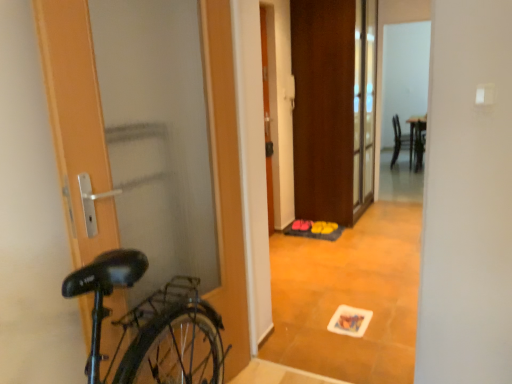
Question: Considering the positions of matte black chair at upper right and wooden floor mat at center in the image, is matte black chair at upper right bigger or smaller than wooden floor mat at center?

Choices:
 (A) big
 (B) small

Answer: (B)

Question: Is matte black chair at upper right in front of or behind wooden floor mat at center in the image?

Choices:
 (A) behind
 (B) front

Answer: (A)

Question: Which object is the closest to the wooden floor mat at center?

Choices:
 (A) brown matte door at center, placed as the 3th door when sorted from left to right
 (B) orange matte door at center, the 2th door positioned from the right
 (C) matte black chair at upper right
 (D) wooden door at left, arranged as the third door when viewed from the right
 (E) yellow rubber doormat at center

Answer: (E)

Question: Estimate the real-world distances between objects in this image. Which object is closer to the wooden floor mat at center?

Choices:
 (A) matte black chair at upper right
 (B) orange matte door at center, the 2th door positioned from the back
 (C) brown matte door at center, positioned as the first door in right-to-left order
 (D) wooden door at left, arranged as the third door when viewed from the right
 (E) yellow rubber doormat at center

Answer: (E)